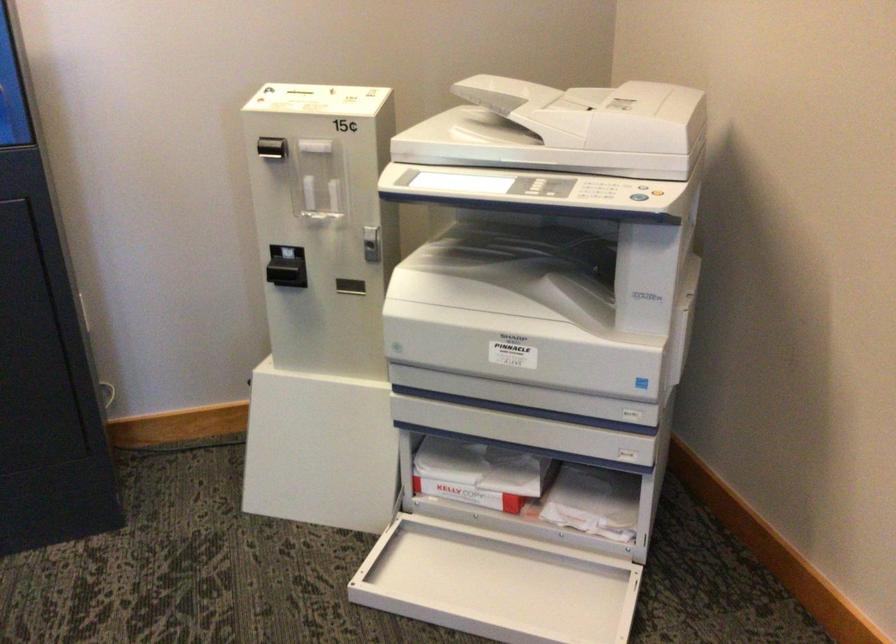
Find the location of a particular element. The height and width of the screenshot is (644, 896). bill acceptor slot is located at coordinates (286, 272).